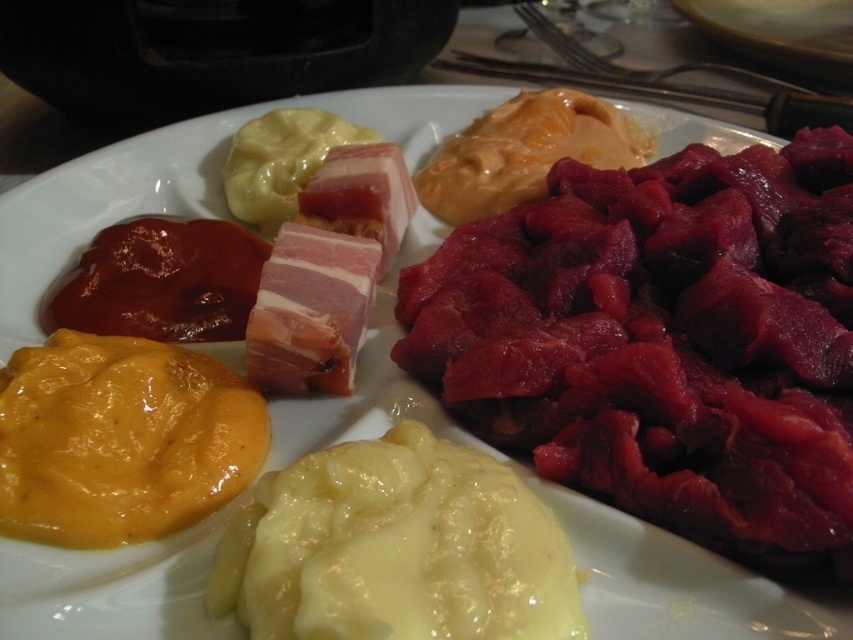
Based on the photo, you are a food critic analyzing the plate layout. Where is the yellow creamy cheese at lower left located in relation to the beetroot salad on the right side of the plate?

The yellow creamy cheese at lower left is located at point (120, 440), which is to the left of the beetroot salad on the right side of the plate.

You are a food critic evaluating the presentation of this dish. You notice two sauces on the plate, the yellow creamy cheese at lower left and the shiny red sauce at upper left. Which sauce has a larger width?

The yellow creamy cheese at lower left has a larger width than the shiny red sauce at upper left according to the description.

In the scene shown: You are a food critic evaluating this dish. You want to taste the yellow creamy cheese at lower left and the shiny red sauce at upper left. Which sauce should you pick up first based on their positions?

The yellow creamy cheese at lower left is in front of the shiny red sauce at upper left, so you should pick up the yellow creamy cheese at lower left first as it is closer to you.